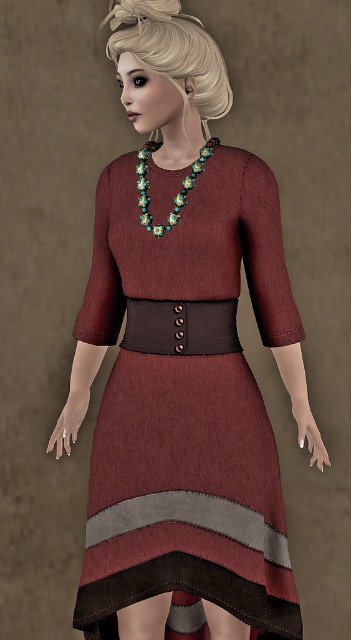
Question: Can you confirm if maroon woolen dress at center is wider than beaded floral necklace at center?

Choices:
 (A) yes
 (B) no

Answer: (A)

Question: Which point appears closest to the camera in this image?

Choices:
 (A) (188, 552)
 (B) (151, 228)

Answer: (B)

Question: Considering the relative positions of maroon woolen dress at center and beaded floral necklace at center in the image provided, where is maroon woolen dress at center located with respect to beaded floral necklace at center?

Choices:
 (A) below
 (B) above

Answer: (A)

Question: Observing the image, what is the correct spatial positioning of maroon woolen dress at center in reference to beaded floral necklace at center?

Choices:
 (A) left
 (B) right

Answer: (B)